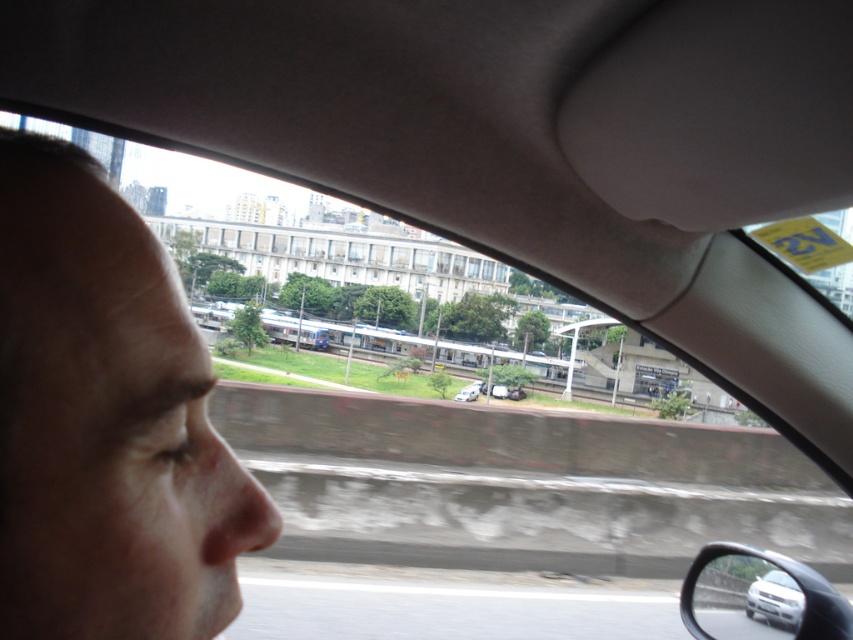
Does smooth skin face at left appear on the right side of silver metallic side mirror at lower right?

In fact, smooth skin face at left is to the left of silver metallic side mirror at lower right.

Who is more distant from viewer, (148,236) or (753,550)?

The point (753,550) is behind.

I want to click on smooth skin face at left, so click(x=106, y=420).

Describe the element at coordinates (106, 420) in the screenshot. I see `smooth skin face at left` at that location.

The image size is (853, 640). I want to click on smooth skin face at left, so click(x=106, y=420).

Is silver metallic side mirror at lower right wider than silver metallic car at lower right?

Yes, silver metallic side mirror at lower right is wider than silver metallic car at lower right.

Between silver metallic side mirror at lower right and silver metallic car at lower right, which one has less height?

Standing shorter between the two is silver metallic car at lower right.

Which is behind, point (784, 620) or point (755, 609)?

Positioned behind is point (755, 609).

You are a GUI agent. You are given a task and a screenshot of the screen. Output one action in this format:
    pyautogui.click(x=<x>, y=<y>)
    Task: Click on the silver metallic side mirror at lower right
    Image resolution: width=853 pixels, height=640 pixels.
    Given the screenshot: What is the action you would take?
    pyautogui.click(x=759, y=596)